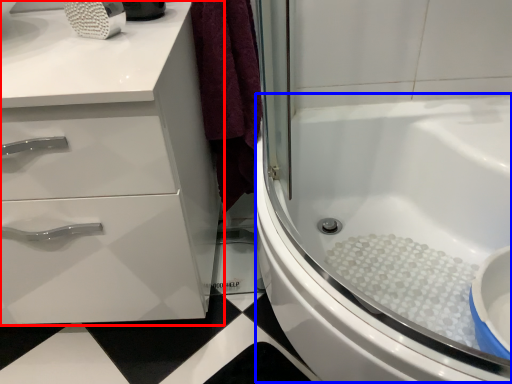
Question: Which object appears farthest to the camera in this image, bathroom cabinet (highlighted by a red box) or bath (highlighted by a blue box)?

Choices:
 (A) bathroom cabinet
 (B) bath

Answer: (A)